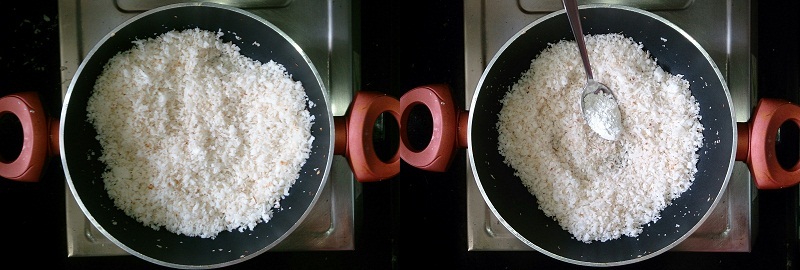
Find the location of a particular element. spoon is located at coordinates (590, 79).